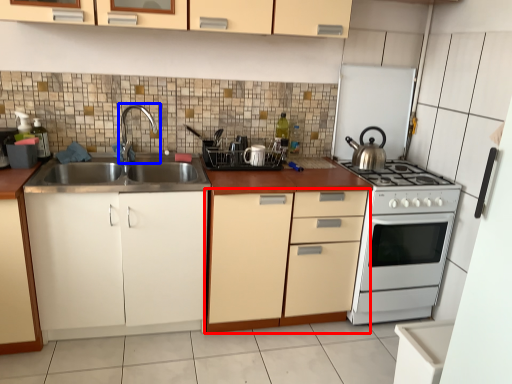
Question: Which point is closer to the camera, cabinetry (highlighted by a red box) or tap (highlighted by a blue box)?

Choices:
 (A) cabinetry
 (B) tap

Answer: (A)